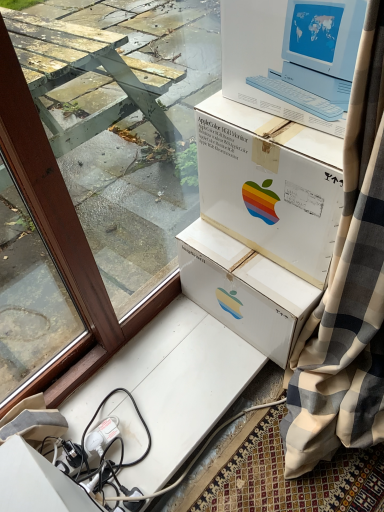
Question: Is white plastic apple monitor at upper center positioned far away from brown wood window frame at upper left?

Choices:
 (A) yes
 (B) no

Answer: (B)

Question: From the image's perspective, is white plastic apple monitor at upper center over brown wood window frame at upper left?

Choices:
 (A) no
 (B) yes

Answer: (B)

Question: Is white plastic apple monitor at upper center next to brown wood window frame at upper left and touching it?

Choices:
 (A) no
 (B) yes

Answer: (A)

Question: Is white plastic apple monitor at upper center facing away from brown wood window frame at upper left?

Choices:
 (A) no
 (B) yes

Answer: (A)

Question: From a real-world perspective, is white plastic apple monitor at upper center on brown wood window frame at upper left?

Choices:
 (A) no
 (B) yes

Answer: (B)

Question: Is white plastic apple monitor at upper center in front of brown wood window frame at upper left?

Choices:
 (A) no
 (B) yes

Answer: (A)

Question: Considering the relative positions of white cardboard box at upper center and brown wood window frame at upper left in the image provided, is white cardboard box at upper center to the left of brown wood window frame at upper left from the viewer's perspective?

Choices:
 (A) no
 (B) yes

Answer: (A)

Question: Are white cardboard box at upper center and brown wood window frame at upper left located far from each other?

Choices:
 (A) yes
 (B) no

Answer: (B)

Question: From the image's perspective, does white cardboard box at upper center appear lower than brown wood window frame at upper left?

Choices:
 (A) yes
 (B) no

Answer: (B)

Question: Is white cardboard box at upper center surrounding brown wood window frame at upper left?

Choices:
 (A) yes
 (B) no

Answer: (B)

Question: Can we say white cardboard box at upper center lies outside brown wood window frame at upper left?

Choices:
 (A) yes
 (B) no

Answer: (A)

Question: Does white cardboard box at upper center have a lesser height compared to brown wood window frame at upper left?

Choices:
 (A) yes
 (B) no

Answer: (A)

Question: From a real-world perspective, is white plastic apple monitor at upper center located higher than white cardboard box at upper center?

Choices:
 (A) yes
 (B) no

Answer: (A)